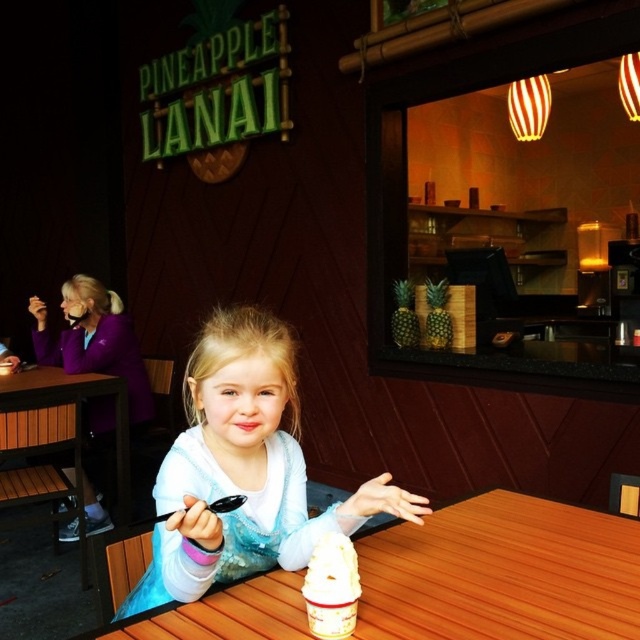
Question: Does wooden table at center appear on the left side of white creamy ice cream at lower center?

Choices:
 (A) yes
 (B) no

Answer: (B)

Question: Which object is farther from the camera taking this photo?

Choices:
 (A) white satin dress at center
 (B) brown wooden table at lower left
 (C) white creamy ice cream at lower center
 (D) wooden table at center

Answer: (B)

Question: Which of the following is the closest to the observer?

Choices:
 (A) (340, 632)
 (B) (244, 436)

Answer: (A)

Question: Is the position of wooden table at center less distant than that of brown wooden table at lower left?

Choices:
 (A) no
 (B) yes

Answer: (B)

Question: Which of the following is the closest to the observer?

Choices:
 (A) wooden table at center
 (B) white creamy ice cream at lower center
 (C) brown wooden table at lower left

Answer: (B)

Question: Does brown wooden table at lower left have a greater width compared to white creamy ice cream at lower center?

Choices:
 (A) yes
 (B) no

Answer: (A)